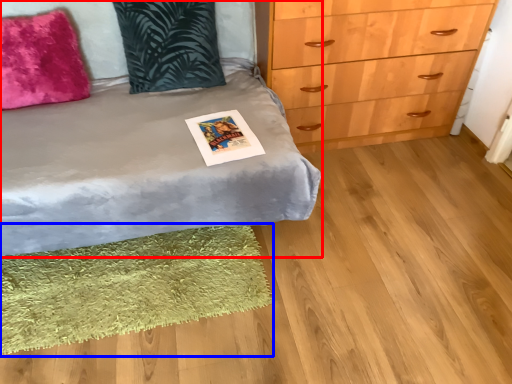
Question: Which of the following is the closest to the observer, bed (highlighted by a red box) or mat (highlighted by a blue box)?

Choices:
 (A) bed
 (B) mat

Answer: (A)